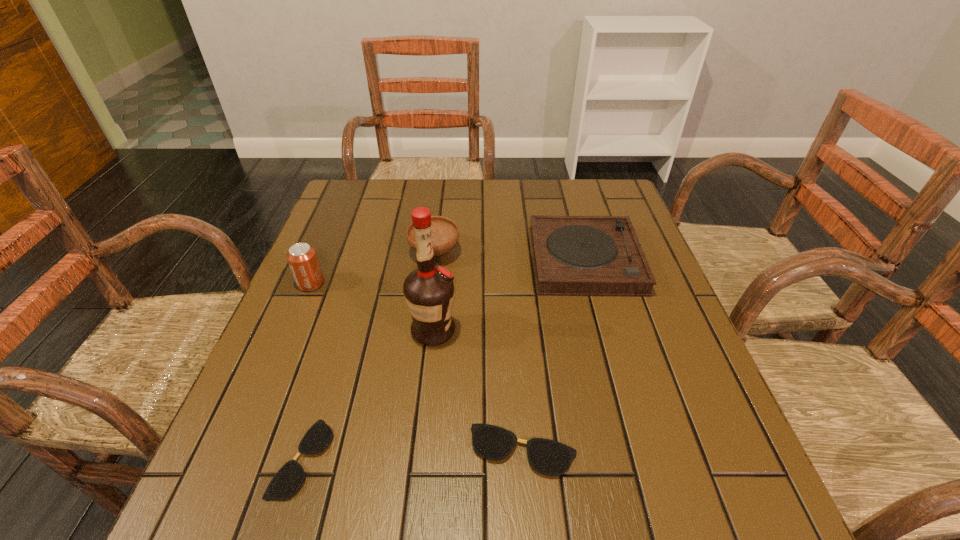
The spectacless are evenly distributed in the image. To maintain this, where would you place another spectacles on the right? Please point to a free space. Please provide its 2D coordinates. Your answer should be formatted as a tuple, i.e. [(x, y)], where the tuple contains the x and y coordinates of a point satisfying the conditions above.

[(738, 443)]